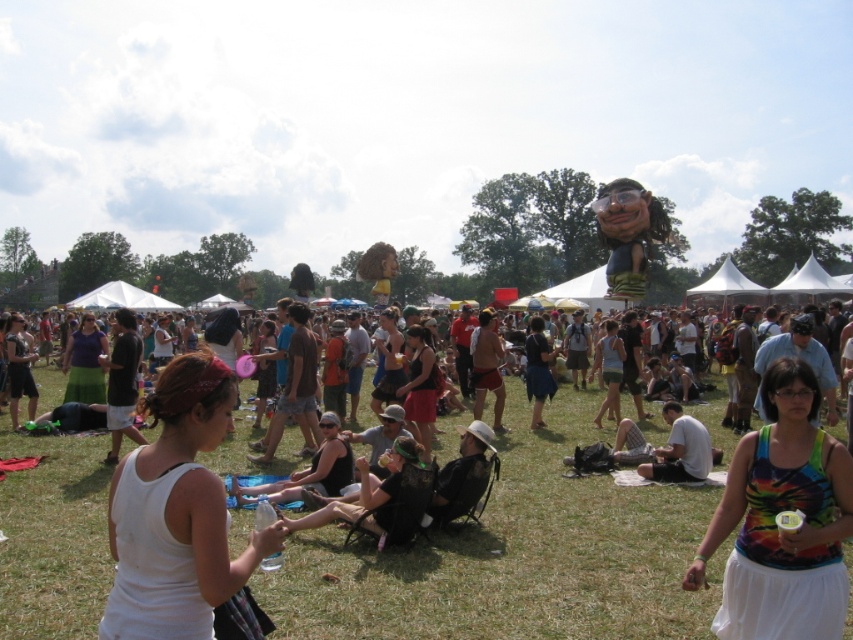
Locate an element on the screen. The width and height of the screenshot is (853, 640). white cotton tank top at center is located at coordinates (776, 525).

Is point (799, 625) positioned in front of point (427, 344)?

Yes, it is in front of point (427, 344).

Where is `white cotton tank top at center`? white cotton tank top at center is located at coordinates (776, 525).

Does white tank top at center have a smaller size compared to matte black tank top at center?

Correct, white tank top at center occupies less space than matte black tank top at center.

Is point (181, 406) closer to viewer compared to point (415, 348)?

Yes, point (181, 406) is closer to viewer.

Where is `white tank top at center`? white tank top at center is located at coordinates (180, 520).

Can you confirm if white tank top at center is wider than white cotton tank top at center?

No.

Is white tank top at center bigger than white cotton tank top at center?

Incorrect, white tank top at center is not larger than white cotton tank top at center.

Is point (206, 416) behind point (763, 524)?

That is False.

Identify the location of white tank top at center. This screenshot has width=853, height=640. (180, 520).